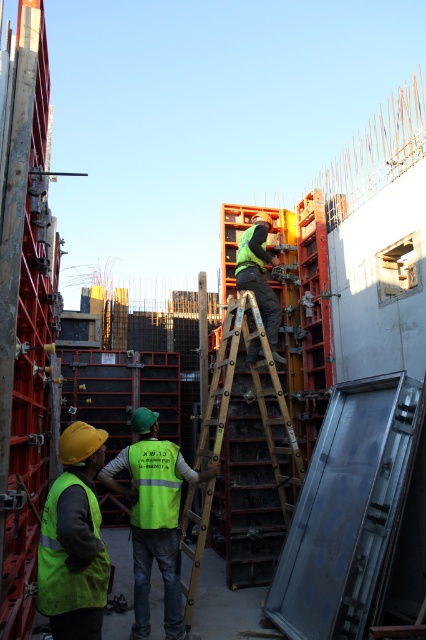
Is reflective yellow-green safety vest at lower left below green reflective vest at center?

Yes.

Is reflective yellow-green safety vest at lower left further to camera compared to green reflective vest at center?

No, reflective yellow-green safety vest at lower left is closer to the viewer.

Identify the location of reflective yellow-green safety vest at lower left. The width and height of the screenshot is (426, 640). (155, 483).

Identify the location of reflective yellow-green safety vest at lower left. This screenshot has height=640, width=426. (155, 483).

Does yellow hard hat at lower left have a greater height compared to green reflective vest at center?

No, yellow hard hat at lower left is not taller than green reflective vest at center.

Is point (94, 516) positioned behind point (239, 276)?

No.

The width and height of the screenshot is (426, 640). I want to click on yellow hard hat at lower left, so click(x=74, y=540).

Who is more distant from viewer, (66, 576) or (176, 596)?

The point (176, 596) is behind.

Is yellow hard hat at lower left closer to the viewer compared to high visibility yellow-green vest at center?

Yes, it is in front of high visibility yellow-green vest at center.

At what (x,y) coordinates should I click in order to perform the action: click on yellow hard hat at lower left. Please return your answer as a coordinate pair (x, y). The image size is (426, 640). Looking at the image, I should click on (74, 540).